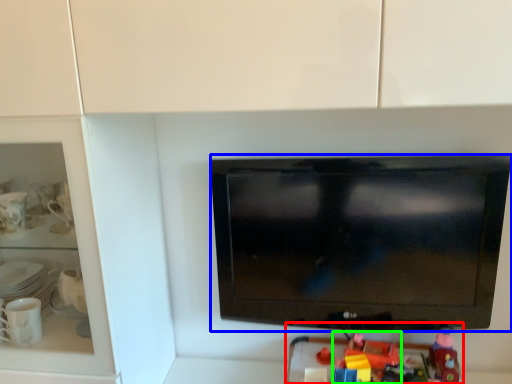
Question: Which object is positioned closest to toy (highlighted by a red box)? Select from television (highlighted by a blue box) and toy (highlighted by a green box).

Choices:
 (A) television
 (B) toy

Answer: (B)